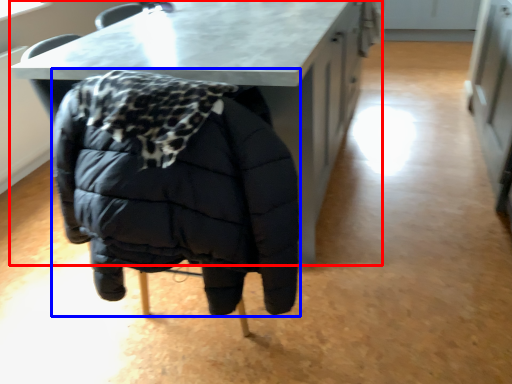
Question: Which of the following is the farthest to the observer, table (highlighted by a red box) or jacket (highlighted by a blue box)?

Choices:
 (A) table
 (B) jacket

Answer: (A)